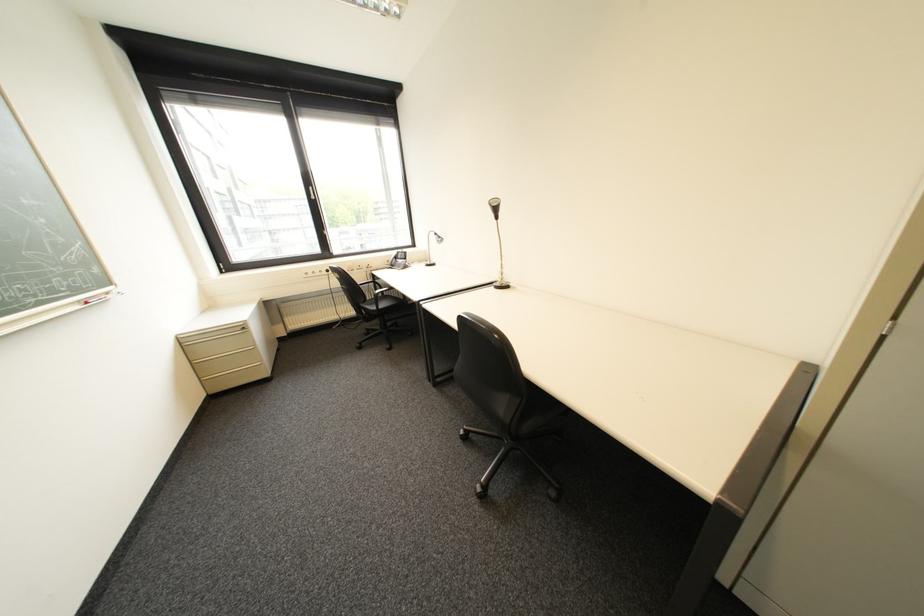
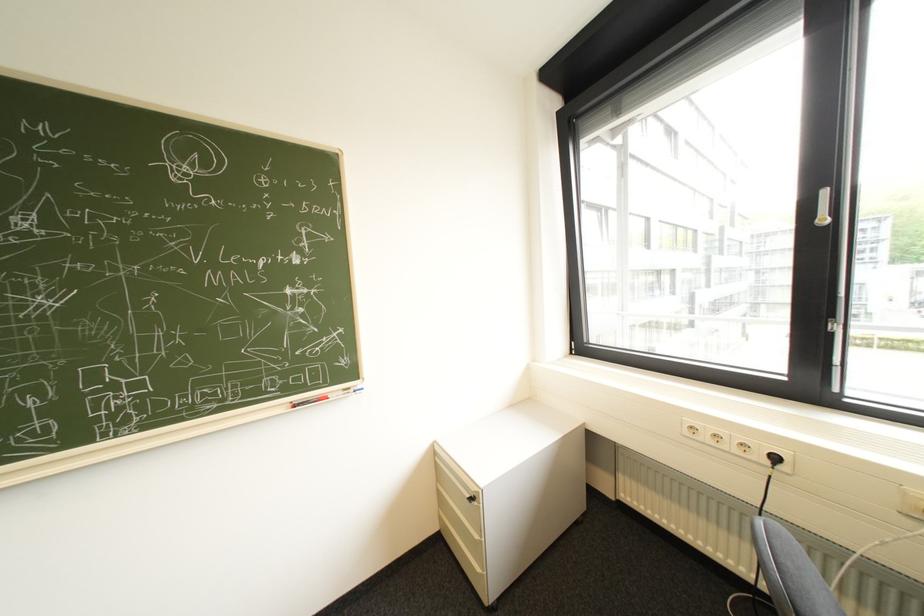
In the second image, find the point that corresponds to (337,274) in the first image.

(779, 463)